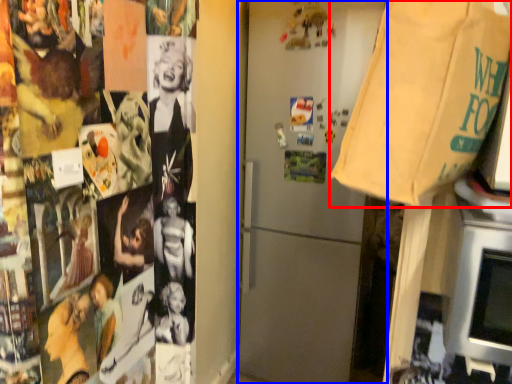
Question: Which point is closer to the camera, grocery bag (highlighted by a red box) or refrigerator (highlighted by a blue box)?

Choices:
 (A) grocery bag
 (B) refrigerator

Answer: (A)